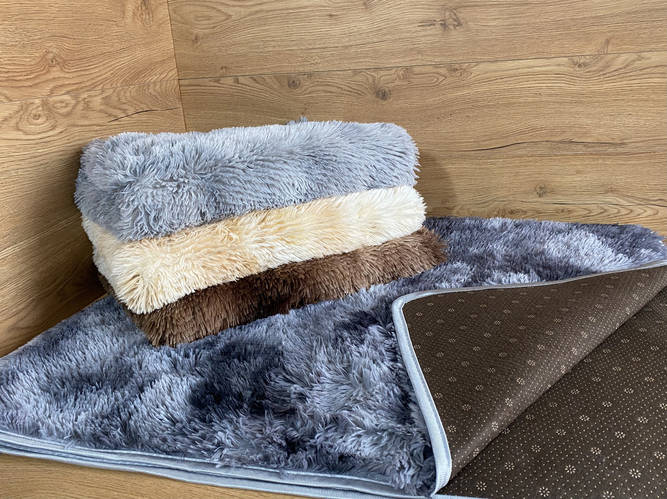
Locate an element on the screen. The width and height of the screenshot is (667, 499). towel is located at coordinates (277, 242).